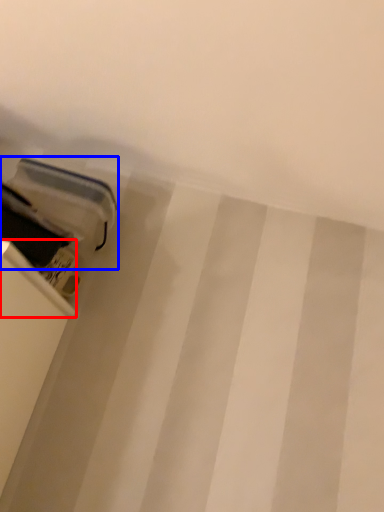
Question: Which object appears farthest to the camera in this image, shelf (highlighted by a red box) or equipment (highlighted by a blue box)?

Choices:
 (A) shelf
 (B) equipment

Answer: (B)